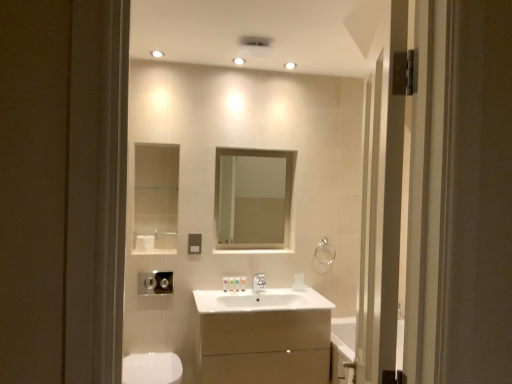
What is the approximate width of silver metallic towel bar at center right?

1.66 inches.

Measure the distance between silver metallic faucet at center and camera.

The distance of silver metallic faucet at center from camera is 2.85 meters.

Describe the element at coordinates (237, 284) in the screenshot. Image resolution: width=512 pixels, height=384 pixels. I see `translucent plastic soap at center, the second toiletry in the right-to-left sequence` at that location.

Find the location of a particular element. white glossy tube at center, the first toiletry from the right is located at coordinates (243, 283).

The width and height of the screenshot is (512, 384). What do you see at coordinates (145, 243) in the screenshot?
I see `white matte toilet paper at upper left` at bounding box center [145, 243].

Find the location of `clear glass mirror at center`. clear glass mirror at center is located at coordinates (251, 200).

Based on their positions, is white glossy light fixture at upper center located to the left or right of white glossy cabinet at center?

In the image, white glossy light fixture at upper center appears on the right side of white glossy cabinet at center.

This screenshot has height=384, width=512. What are the coordinates of `light fixture lying above the white glossy cabinet at center (from the image's perspective)` in the screenshot? It's located at (290, 65).

Does white glossy light fixture at upper center have a lesser height compared to white glossy cabinet at center?

Yes.

Which object is wider, white glossy toilet bowl at lower left or metallic silver hand dryer at lower center?

white glossy toilet bowl at lower left.

The image size is (512, 384). Identify the location of hand dryer that appears behind the white glossy toilet bowl at lower left. (155, 283).

Can you tell me how much white glossy toilet bowl at lower left and metallic silver hand dryer at lower center differ in facing direction?

white glossy toilet bowl at lower left and metallic silver hand dryer at lower center are facing 0.776 degrees away from each other.

Are white glossy toilet bowl at lower left and metallic silver hand dryer at lower center located far from each other?

No, there isn't a large distance between white glossy toilet bowl at lower left and metallic silver hand dryer at lower center.

Is white glossy tube at center, the first toiletry from the right, at the back of matte silver switch at center?

No, white glossy tube at center, the first toiletry from the right, is not at the back of matte silver switch at center.

Consider the image. Is matte silver switch at center with white glossy tube at center, positioned as the second toiletry in left-to-right order?

There is a gap between matte silver switch at center and white glossy tube at center, positioned as the second toiletry in left-to-right order.

Can we say matte silver switch at center lies outside white glossy tube at center, the first toiletry from the right?

Absolutely, matte silver switch at center is external to white glossy tube at center, the first toiletry from the right.

From a real-world perspective, who is located lower, matte silver switch at center or white glossy tube at center, positioned as the second toiletry in left-to-right order?

In real-world perspective, white glossy tube at center, positioned as the second toiletry in left-to-right order, is lower.

From the picture: How many degrees apart are the facing directions of silver metallic towel bar at center right and metallic silver hand dryer at lower center?

The facing directions of silver metallic towel bar at center right and metallic silver hand dryer at lower center are 1.02 degrees apart.

From the picture: From the image's perspective, between silver metallic towel bar at center right and metallic silver hand dryer at lower center, which one is located above?

silver metallic towel bar at center right appears higher in the image.

Locate an element on the screen. hand dryer on the left of silver metallic towel bar at center right is located at coordinates (155, 283).

Is silver metallic towel bar at center right facing towards metallic silver hand dryer at lower center?

No, silver metallic towel bar at center right is not aimed at metallic silver hand dryer at lower center.

From a real-world perspective, between matte silver switch at center and metallic silver hand dryer at lower center, who is vertically higher?

In real-world perspective, matte silver switch at center is above.

Based on their sizes in the image, would you say matte silver switch at center is bigger or smaller than metallic silver hand dryer at lower center?

Considering their sizes, matte silver switch at center takes up less space than metallic silver hand dryer at lower center.

Is matte silver switch at center looking in the opposite direction of metallic silver hand dryer at lower center?

No, matte silver switch at center is not facing away from metallic silver hand dryer at lower center.

Would you say metallic silver hand dryer at lower center is part of matte silver switch at center's contents?

Definitely not — metallic silver hand dryer at lower center is not inside matte silver switch at center.

Is point (284, 344) positioned before point (241, 277)?

That is True.

From a real-world perspective, who is located higher, white glossy cabinet at center or white glossy tube at center, positioned as the second toiletry in left-to-right order?

white glossy tube at center, positioned as the second toiletry in left-to-right order.

Measure the distance between white glossy cabinet at center and white glossy tube at center, the first toiletry from the right.

white glossy cabinet at center and white glossy tube at center, the first toiletry from the right, are 19.10 inches apart from each other.

Is white glossy cabinet at center situated inside white glossy tube at center, the first toiletry from the right, or outside?

white glossy cabinet at center lies outside white glossy tube at center, the first toiletry from the right.

Is white matte toilet paper at upper left oriented towards silver metallic towel bar at center right?

No, white matte toilet paper at upper left is not aimed at silver metallic towel bar at center right.

Is white matte toilet paper at upper left positioned far away from silver metallic towel bar at center right?

Yes.

What's the angular difference between white matte toilet paper at upper left and silver metallic towel bar at center right's facing directions?

0.355 degrees.

There is a silver metallic towel bar at center right. Identify the location of toilet paper above it (from a real-world perspective). (145, 243).

Where is `light fixture behind the white glossy cabinet at center`? This screenshot has height=384, width=512. light fixture behind the white glossy cabinet at center is located at coordinates (290, 65).

Where is `toilet bowl below the metallic silver hand dryer at lower center (from the image's perspective)`? This screenshot has height=384, width=512. toilet bowl below the metallic silver hand dryer at lower center (from the image's perspective) is located at coordinates (152, 368).

In the scene shown: Considering their positions, is metallic silver hand dryer at lower center positioned further to silver metallic faucet at center than white glossy tube at center, positioned as the second toiletry in left-to-right order?

metallic silver hand dryer at lower center.

When comparing their distances from white glossy cabinet at center, does clear glass mirror at center or silver metallic faucet at center seem further?

Among the two, clear glass mirror at center is located further to white glossy cabinet at center.

Based on their spatial positions, is white glossy tube at center, the first toiletry from the right, or silver metallic towel bar at center right closer to silver metallic faucet at center?

The object closer to silver metallic faucet at center is white glossy tube at center, the first toiletry from the right.

Considering their positions, is matte silver switch at center positioned further to metallic silver hand dryer at lower center than white glossy light fixture at upper center?

white glossy light fixture at upper center is positioned further to the anchor metallic silver hand dryer at lower center.

Based on their spatial positions, is white glossy tube at center, the first toiletry from the right, or matte silver switch at center further from silver metallic faucet at center?

matte silver switch at center.

Considering their positions, is clear glass mirror at center positioned further to white glossy toilet bowl at lower left than silver metallic towel bar at center right?

Based on the image, clear glass mirror at center appears to be further to white glossy toilet bowl at lower left.

Looking at this image, estimate the real-world distances between objects in this image. Which object is further from silver metallic faucet at center, metallic silver hand dryer at lower center or white matte toilet paper at upper left?

white matte toilet paper at upper left lies further to silver metallic faucet at center than the other object.

Considering their positions, is white glossy light fixture at upper center positioned further to white glossy tube at center, positioned as the second toiletry in left-to-right order, than white matte toilet paper at upper left?

Among the two, white glossy light fixture at upper center is located further to white glossy tube at center, positioned as the second toiletry in left-to-right order.

Where is `tap positioned between white glossy cabinet at center and white glossy tube at center, positioned as the second toiletry in left-to-right order, from near to far`? Image resolution: width=512 pixels, height=384 pixels. tap positioned between white glossy cabinet at center and white glossy tube at center, positioned as the second toiletry in left-to-right order, from near to far is located at coordinates click(259, 282).

The image size is (512, 384). I want to click on mirror located between white glossy toilet bowl at lower left and silver metallic towel bar at center right in the left-right direction, so click(x=251, y=200).

You are a GUI agent. You are given a task and a screenshot of the screen. Output one action in this format:
    pyautogui.click(x=<x>, y=<y>)
    Task: Click on the toiletry located between translucent plastic soap at center, the second toiletry in the right-to-left sequence, and silver metallic towel bar at center right in the left-right direction
    The height and width of the screenshot is (384, 512).
    Given the screenshot: What is the action you would take?
    pyautogui.click(x=243, y=283)

The image size is (512, 384). Identify the location of towel bar that lies between white glossy light fixture at upper center and white glossy tube at center, the first toiletry from the right, from top to bottom. (325, 252).